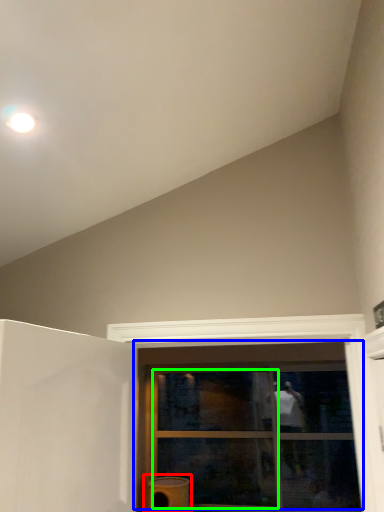
Question: Which object is the closest to the water heater (highlighted by a red box)? Choose among these: window (highlighted by a blue box) or glass door (highlighted by a green box).

Choices:
 (A) window
 (B) glass door

Answer: (B)